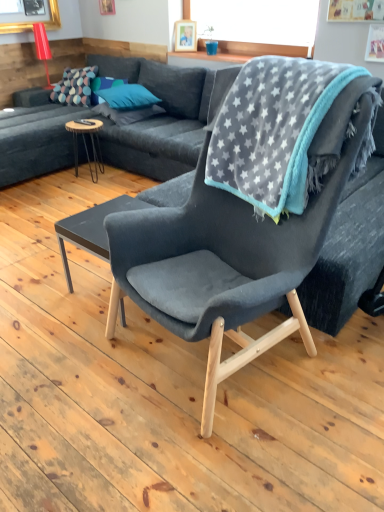
Question: Can you confirm if multicolored dotted fabric pillow at upper left, which is counted as the 3th pillow, starting from the right, is thinner than gray star-patterned blanket at upper right?

Choices:
 (A) yes
 (B) no

Answer: (A)

Question: Can you confirm if multicolored dotted fabric pillow at upper left, which is counted as the 3th pillow, starting from the right, is smaller than gray star-patterned blanket at upper right?

Choices:
 (A) yes
 (B) no

Answer: (A)

Question: Are multicolored dotted fabric pillow at upper left, which is counted as the 3th pillow, starting from the right, and gray star-patterned blanket at upper right located far from each other?

Choices:
 (A) yes
 (B) no

Answer: (A)

Question: Is multicolored dotted fabric pillow at upper left, which ranks as the 1th pillow in left-to-right order, to the left of gray star-patterned blanket at upper right from the viewer's perspective?

Choices:
 (A) yes
 (B) no

Answer: (A)

Question: Is multicolored dotted fabric pillow at upper left, which is counted as the 3th pillow, starting from the right, in contact with gray star-patterned blanket at upper right?

Choices:
 (A) yes
 (B) no

Answer: (B)

Question: Is multicolored dotted fabric pillow at upper left, which ranks as the 1th pillow in left-to-right order, wider or thinner than dark gray matte coffee table at center, the 1th coffee table positioned from the right?

Choices:
 (A) thin
 (B) wide

Answer: (A)

Question: From a real-world perspective, relative to dark gray matte coffee table at center, acting as the second coffee table starting from the left, is multicolored dotted fabric pillow at upper left, which is counted as the 3th pillow, starting from the right, vertically above or below?

Choices:
 (A) below
 (B) above

Answer: (B)

Question: Considering their positions, is multicolored dotted fabric pillow at upper left, which is counted as the 3th pillow, starting from the right, located in front of or behind dark gray matte coffee table at center, the 1th coffee table positioned from the right?

Choices:
 (A) behind
 (B) front

Answer: (A)

Question: Would you say multicolored dotted fabric pillow at upper left, which is counted as the 3th pillow, starting from the right, is inside or outside dark gray matte coffee table at center, acting as the 1th coffee table starting from the bottom?

Choices:
 (A) outside
 (B) inside

Answer: (A)

Question: From the image's perspective, is wooden round table at left, the 1th coffee table from the back, positioned above or below teal fabric pillow at center, the 2th pillow from the left?

Choices:
 (A) above
 (B) below

Answer: (B)

Question: Do you think wooden round table at left, which is counted as the 1th coffee table, starting from the left, is within teal fabric pillow at center, the second pillow viewed from the right, or outside of it?

Choices:
 (A) outside
 (B) inside

Answer: (A)

Question: From a real-world perspective, is wooden round table at left, which ranks as the second coffee table in front-to-back order, positioned above or below teal fabric pillow at center, the 2th pillow from the left?

Choices:
 (A) above
 (B) below

Answer: (B)

Question: Considering the relative positions of wooden round table at left, acting as the second coffee table starting from the bottom, and teal fabric pillow at center, the 2th pillow from the left, in the image provided, is wooden round table at left, acting as the second coffee table starting from the bottom, to the left or to the right of teal fabric pillow at center, the 2th pillow from the left,?

Choices:
 (A) left
 (B) right

Answer: (A)

Question: Looking at their shapes, would you say teal fabric pillow at upper left, the 3th pillow from the left, is wider or thinner than dark gray fabric couch at upper left?

Choices:
 (A) wide
 (B) thin

Answer: (B)

Question: From the image's perspective, is teal fabric pillow at upper left, which is counted as the first pillow, starting from the right, located above or below dark gray fabric couch at upper left?

Choices:
 (A) above
 (B) below

Answer: (A)